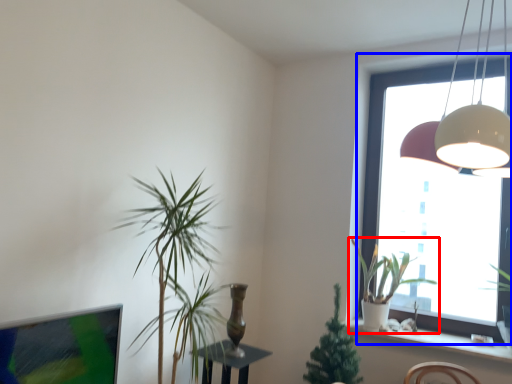
Question: Which of the following is the farthest to the observer, houseplant (highlighted by a red box) or window (highlighted by a blue box)?

Choices:
 (A) houseplant
 (B) window

Answer: (B)